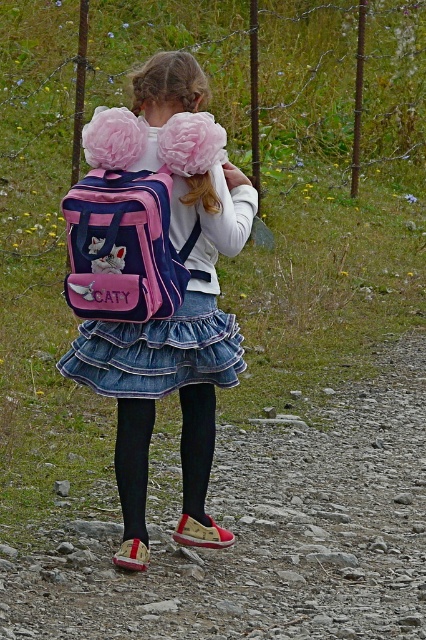
Does pink fabric backpack at center have a smaller size compared to denim skirt at center?

Actually, pink fabric backpack at center might be larger than denim skirt at center.

Is point (222, 177) positioned in front of point (250, 205)?

Yes.

Image resolution: width=426 pixels, height=640 pixels. I want to click on pink fabric backpack at center, so click(x=157, y=282).

Can you confirm if rough gravel path at center is positioned below pink fabric backpack at back?

Yes.

Does point (264, 564) come in front of point (77, 289)?

No, (264, 564) is behind (77, 289).

Locate an element on the screen. rough gravel path at center is located at coordinates (256, 532).

Is rough gravel path at center to the right of black tights at center from the viewer's perspective?

Correct, you'll find rough gravel path at center to the right of black tights at center.

From the picture: Which is more to the left, rough gravel path at center or black tights at center?

Positioned to the left is black tights at center.

This screenshot has width=426, height=640. What do you see at coordinates (256, 532) in the screenshot?
I see `rough gravel path at center` at bounding box center [256, 532].

Image resolution: width=426 pixels, height=640 pixels. I want to click on rough gravel path at center, so click(x=256, y=532).